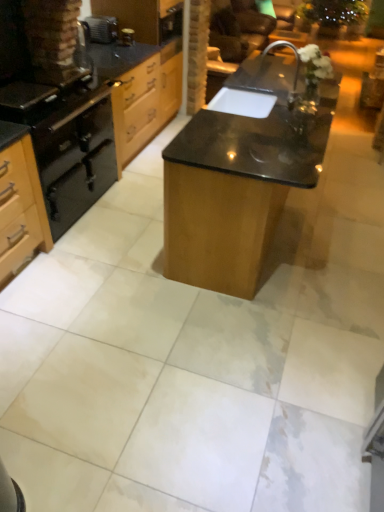
Where is `vacant position to the left of metallic canister at upper center, the first appliance from the right`? The width and height of the screenshot is (384, 512). vacant position to the left of metallic canister at upper center, the first appliance from the right is located at coordinates (112, 48).